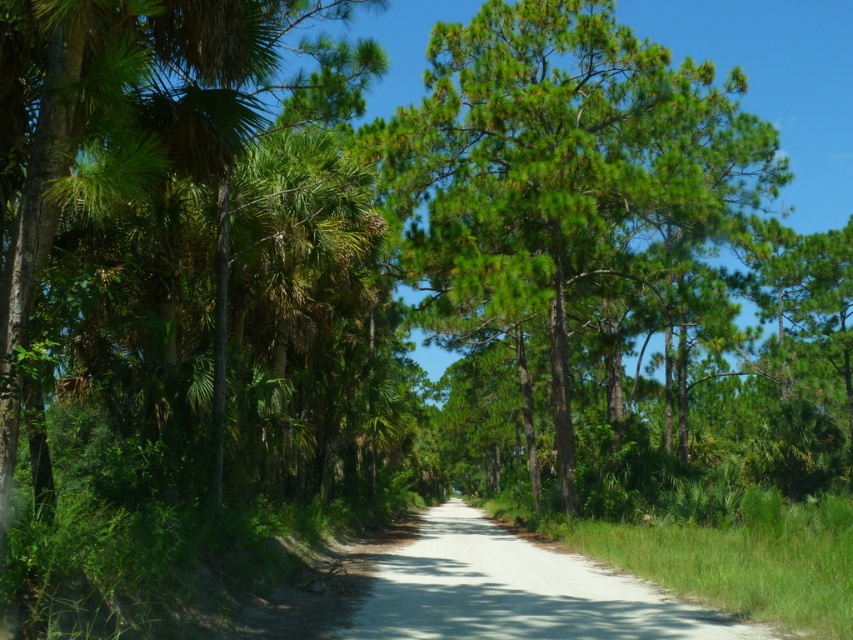
Question: In this image, where is green needle-like at center located relative to gravel road at center?

Choices:
 (A) right
 (B) left

Answer: (A)

Question: Which of the following is the farthest from the observer?

Choices:
 (A) gravel road at center
 (B) green needle-like at center

Answer: (B)

Question: Among these points, which one is nearest to the camera?

Choices:
 (A) (x=538, y=566)
 (B) (x=491, y=54)

Answer: (A)

Question: Can you confirm if green needle-like at center is positioned to the right of gravel road at center?

Choices:
 (A) no
 (B) yes

Answer: (B)

Question: Which of the following is the closest to the observer?

Choices:
 (A) (628, 602)
 (B) (729, 115)

Answer: (A)

Question: Can you confirm if green needle-like at center is wider than gravel road at center?

Choices:
 (A) yes
 (B) no

Answer: (A)